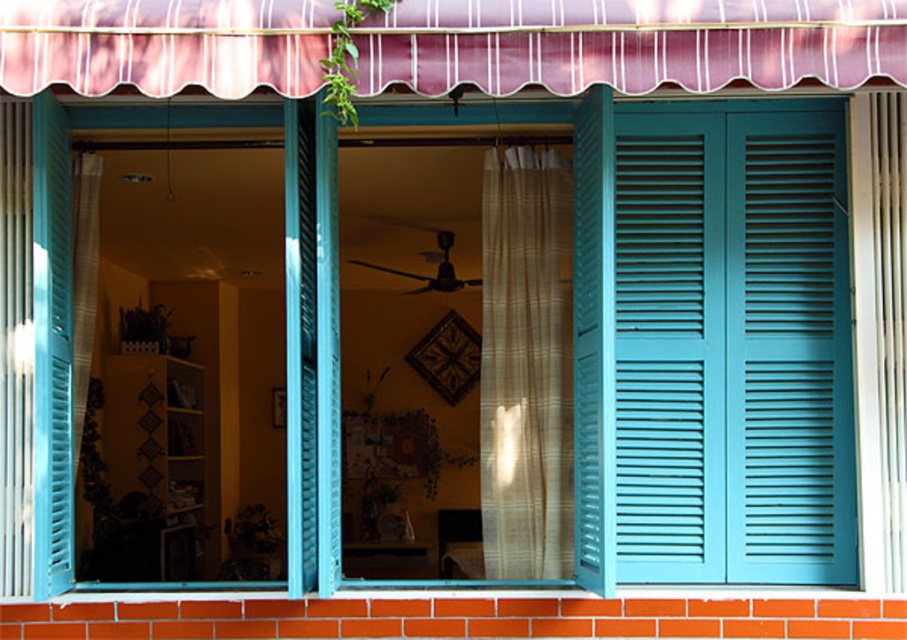
Question: From the image, what is the correct spatial relationship of translucent beige curtain at center in relation to white sheer curtain at right?

Choices:
 (A) above
 (B) below

Answer: (B)

Question: Is white sheer curtain at right to the left of translucent fabric curtain at left from the viewer's perspective?

Choices:
 (A) no
 (B) yes

Answer: (A)

Question: Which object is positioned closest to the white sheer curtain at right?

Choices:
 (A) translucent beige curtain at center
 (B) teal matte shutters at right

Answer: (B)

Question: Which of the following is the farthest from the observer?

Choices:
 (A) translucent fabric curtain at left
 (B) translucent beige curtain at center
 (C) white sheer curtain at right

Answer: (B)

Question: Estimate the real-world distances between objects in this image. Which object is farther from the teal matte shutters at right?

Choices:
 (A) translucent fabric curtain at left
 (B) white sheer curtain at right

Answer: (A)

Question: Can you confirm if translucent beige curtain at center is smaller than translucent fabric curtain at left?

Choices:
 (A) yes
 (B) no

Answer: (B)